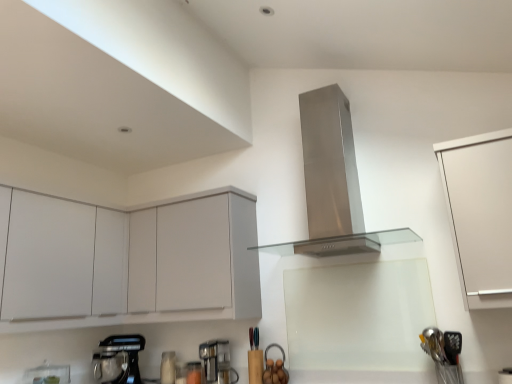
Question: In terms of size, does stainless steel range hood at center appear bigger or smaller than white matte cabinet at right, the 1th cabinetry from the right?

Choices:
 (A) big
 (B) small

Answer: (A)

Question: Considering their positions, is stainless steel range hood at center located in front of or behind white matte cabinet at right, the 1th cabinetry from the right?

Choices:
 (A) front
 (B) behind

Answer: (B)

Question: Estimate the real-world distances between objects in this image. Which object is closer to the white matte cabinet at upper left, acting as the 2th cabinetry starting from the right?

Choices:
 (A) metallic silver mixer at lower left
 (B) white matte cabinet at right, which is the 3th cabinetry from left to right
 (C) satin silver utensils at lower right
 (D) metallic gray coffee machine at lower center
 (E) white matte cabinet at left, which is the 3th cabinetry in right-to-left order

Answer: (D)

Question: Which object is positioned closest to the metallic gray coffee machine at lower center?

Choices:
 (A) stainless steel range hood at center
 (B) white matte cabinet at right, which is the 3th cabinetry from left to right
 (C) white matte cabinet at left, marked as the first cabinetry in a left-to-right arrangement
 (D) satin silver utensils at lower right
 (E) metallic silver mixer at lower left

Answer: (E)